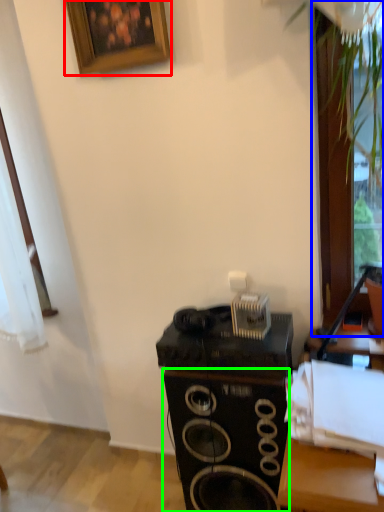
Question: Considering the real-world distances, which object is farthest from picture frame (highlighted by a red box)? glass door (highlighted by a blue box) or speaker (highlighted by a green box)?

Choices:
 (A) glass door
 (B) speaker

Answer: (B)